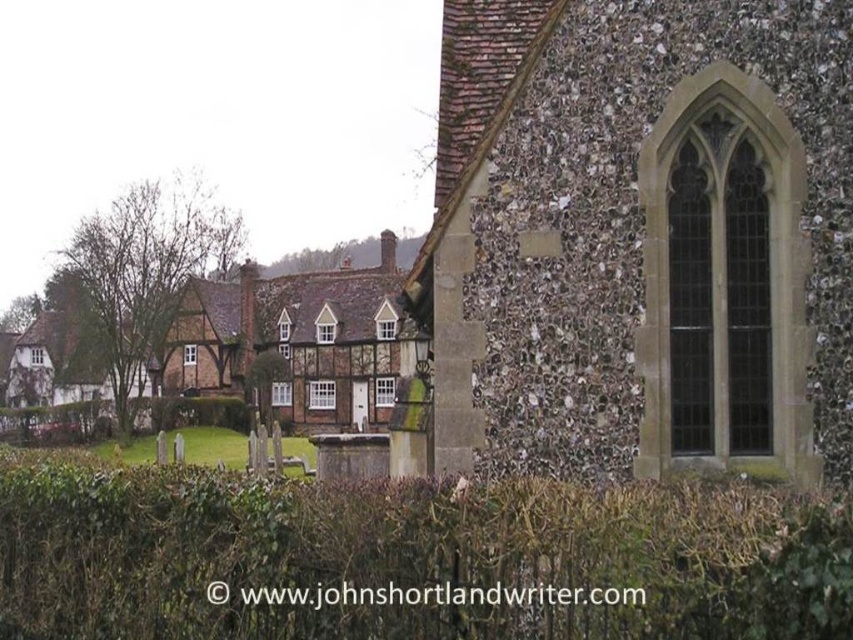
Who is higher up, speckled stone church at center or green leafy hedge at center?

speckled stone church at center is higher up.

Between point (726, 72) and point (631, 564), which one is positioned behind?

Point (726, 72)

Where is `speckled stone church at center`? This screenshot has width=853, height=640. speckled stone church at center is located at coordinates (642, 237).